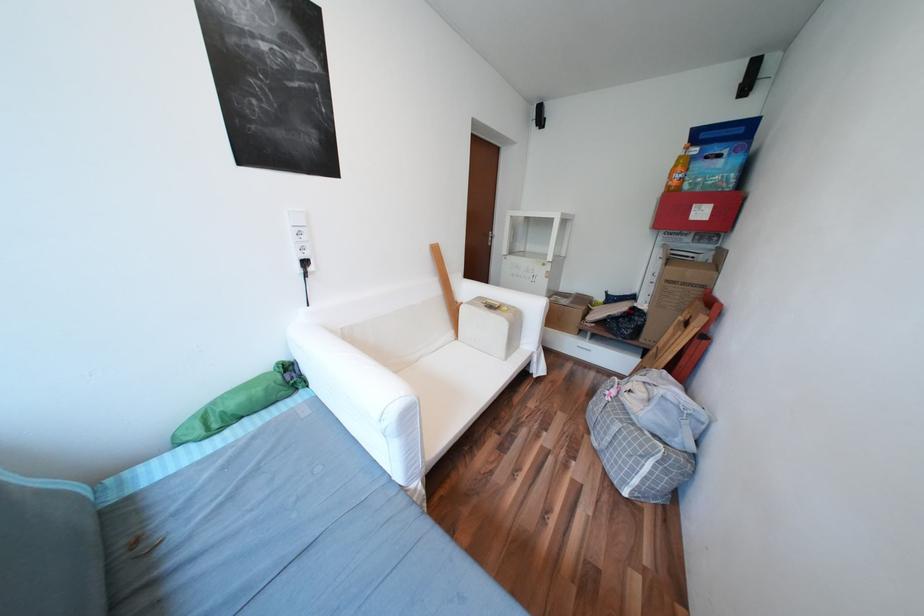
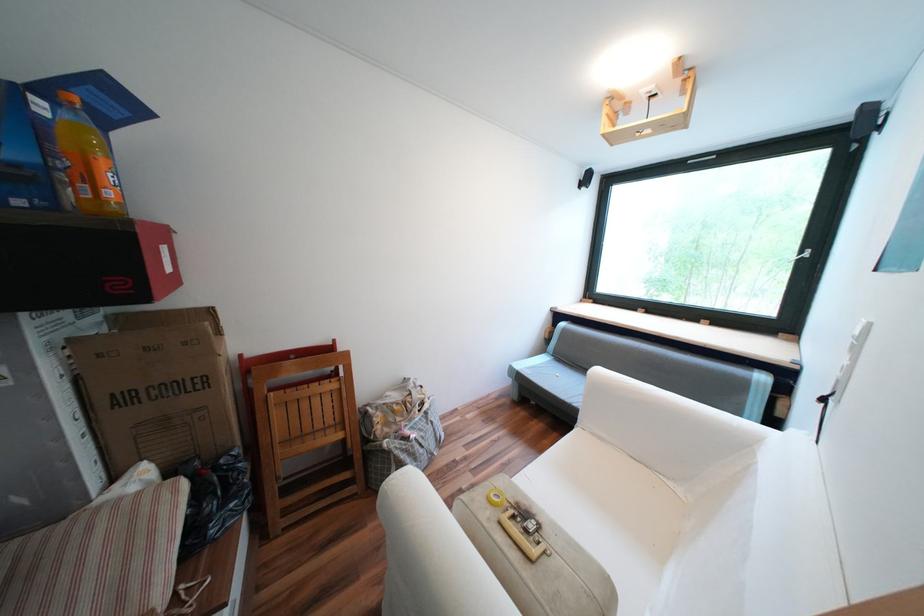
Locate, in the second image, the point that corresponds to pixel 576 390 in the first image.

(387, 548)